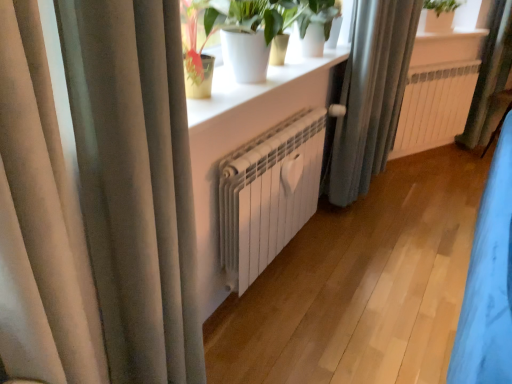
Where is `vacant space in front of green fabric curtain at right, acting as the 1th curtain starting from the right`? vacant space in front of green fabric curtain at right, acting as the 1th curtain starting from the right is located at coordinates (469, 159).